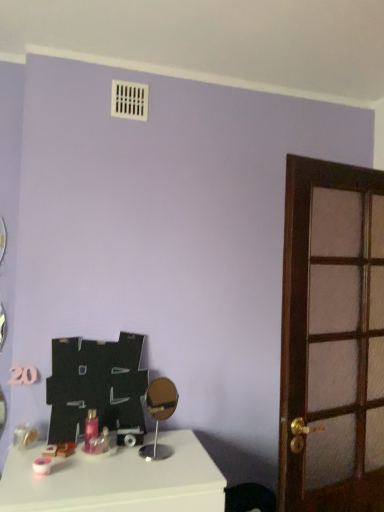
Measure the distance between point [152,391] and camera.

Point [152,391] is 2.02 meters from camera.

At what (x,y) coordinates should I click in order to perform the action: click on white glossy table at lower left. Please return your answer as a coordinate pair (x, y). The image size is (384, 512). Looking at the image, I should click on (116, 480).

Where is `pink glossy bottle at center`? The width and height of the screenshot is (384, 512). pink glossy bottle at center is located at coordinates (90, 429).

You are a GUI agent. You are given a task and a screenshot of the screen. Output one action in this format:
    pyautogui.click(x=<x>, y=<y>)
    Task: Click on the brown wooden door at right
    This screenshot has width=384, height=512.
    Given the screenshot: What is the action you would take?
    pyautogui.click(x=332, y=339)

Can you confirm if white glossy table at lower left is positioned to the right of pink glossy bottle at center?

Correct, you'll find white glossy table at lower left to the right of pink glossy bottle at center.

Considering the relative sizes of white glossy table at lower left and pink glossy bottle at center in the image provided, is white glossy table at lower left shorter than pink glossy bottle at center?

No, white glossy table at lower left is not shorter than pink glossy bottle at center.

Based on the photo, considering the relative sizes of white glossy table at lower left and pink glossy bottle at center in the image provided, is white glossy table at lower left thinner than pink glossy bottle at center?

No, white glossy table at lower left is not thinner than pink glossy bottle at center.

Is white glossy table at lower left turned away from pink glossy bottle at center?

No.

From a real-world perspective, between pink glossy bottle at center and white glossy table at lower left, who is vertically higher?

pink glossy bottle at center.

Considering the sizes of pink glossy bottle at center and white glossy table at lower left in the image, is pink glossy bottle at center bigger or smaller than white glossy table at lower left?

Clearly, pink glossy bottle at center is smaller in size than white glossy table at lower left.

Which of these two, pink glossy bottle at center or white glossy table at lower left, is thinner?

pink glossy bottle at center.

From their relative heights in the image, would you say pink glossy bottle at center is taller or shorter than white glossy table at lower left?

pink glossy bottle at center is shorter than white glossy table at lower left.

Locate an element on the screen. This screenshot has width=384, height=512. door in front of the gold metallic mirror at center is located at coordinates (332, 339).

Which point is more forward, (146,396) or (349,348)?

Positioned in front is point (349,348).

Looking at the image, does gold metallic mirror at center seem bigger or smaller compared to brown wooden door at right?

Clearly, gold metallic mirror at center is smaller in size than brown wooden door at right.

Who is shorter, gold metallic mirror at center or brown wooden door at right?

Standing shorter between the two is gold metallic mirror at center.

Considering the positions of point (367, 490) and point (163, 381), is point (367, 490) closer or farther from the camera than point (163, 381)?

Point (367, 490) is closer to the camera than point (163, 381).

Find the location of a particular element. door above the gold metallic mirror at center (from a real-world perspective) is located at coordinates click(x=332, y=339).

From the picture: Which is more to the left, brown wooden door at right or gold metallic mirror at center?

gold metallic mirror at center is more to the left.

Is brown wooden door at right positioned with its back to gold metallic mirror at center?

No, brown wooden door at right is not facing the opposite direction of gold metallic mirror at center.

Between point (203, 473) and point (160, 404), which one is positioned behind?

Point (160, 404)

From the image's perspective, is white glossy table at lower left located above or below gold metallic mirror at center?

Clearly, from the image's perspective, white glossy table at lower left is below gold metallic mirror at center.

From the picture: What's the angular difference between white glossy table at lower left and gold metallic mirror at center's facing directions?

white glossy table at lower left and gold metallic mirror at center are facing 22.5 degrees away from each other.

In the scene shown: Considering the positions of objects white glossy table at lower left and gold metallic mirror at center in the image provided, who is behind, white glossy table at lower left or gold metallic mirror at center?

Positioned behind is gold metallic mirror at center.

Is point (95, 415) less distant than point (160, 388)?

Yes.

Considering the relative positions of pink glossy bottle at center and gold metallic mirror at center in the image provided, is pink glossy bottle at center to the left of gold metallic mirror at center from the viewer's perspective?

Yes.

From a real-world perspective, is pink glossy bottle at center beneath gold metallic mirror at center?

Yes, from a real-world perspective, pink glossy bottle at center is under gold metallic mirror at center.

Can you tell me how much pink glossy bottle at center and gold metallic mirror at center differ in facing direction?

23.4 degrees separate the facing orientations of pink glossy bottle at center and gold metallic mirror at center.

Is brown wooden door at right positioned with its back to white glossy table at lower left?

No, brown wooden door at right is not facing the opposite direction of white glossy table at lower left.

Considering the positions of point (371, 361) and point (186, 434), is point (371, 361) closer or farther from the camera than point (186, 434)?

Point (371, 361) appears to be closer to the viewer than point (186, 434).

From the image's perspective, is brown wooden door at right located above or below white glossy table at lower left?

Clearly, from the image's perspective, brown wooden door at right is above white glossy table at lower left.

From a real-world perspective, is brown wooden door at right located higher than white glossy table at lower left?

Indeed, from a real-world perspective, brown wooden door at right stands above white glossy table at lower left.

This screenshot has width=384, height=512. In the image, there is a pink glossy bottle at center. In order to click on table below it (from a real-world perspective) in this screenshot , I will do coord(116,480).

Where is `toiletry lying behind the white glossy table at lower left`? The width and height of the screenshot is (384, 512). toiletry lying behind the white glossy table at lower left is located at coordinates (90, 429).

Considering their positions, is gold metallic mirror at center positioned closer to pink glossy bottle at center than brown wooden door at right?

The object closer to pink glossy bottle at center is gold metallic mirror at center.

When comparing their distances from white glossy table at lower left, does brown wooden door at right or pink glossy bottle at center seem closer?

The object closer to white glossy table at lower left is pink glossy bottle at center.

When comparing their distances from gold metallic mirror at center, does pink glossy bottle at center or white glossy table at lower left seem closer?

Based on the image, white glossy table at lower left appears to be nearer to gold metallic mirror at center.

Looking at the image, which one is located further to brown wooden door at right, pink glossy bottle at center or white glossy table at lower left?

Among the two, pink glossy bottle at center is located further to brown wooden door at right.

From the image, which object appears to be nearer to gold metallic mirror at center, white glossy table at lower left or brown wooden door at right?

Among the two, white glossy table at lower left is located nearer to gold metallic mirror at center.

Considering their positions, is pink glossy bottle at center positioned further to white glossy table at lower left than gold metallic mirror at center?

Based on the image, pink glossy bottle at center appears to be further to white glossy table at lower left.

Considering their positions, is gold metallic mirror at center positioned further to pink glossy bottle at center than white glossy table at lower left?

gold metallic mirror at center is positioned further to the anchor pink glossy bottle at center.

Which object lies further to the anchor point brown wooden door at right, white glossy table at lower left or pink glossy bottle at center?

pink glossy bottle at center lies further to brown wooden door at right than the other object.

Where is `table located between pink glossy bottle at center and brown wooden door at right in the left-right direction`? This screenshot has height=512, width=384. table located between pink glossy bottle at center and brown wooden door at right in the left-right direction is located at coordinates (116, 480).

At what (x,y) coordinates should I click in order to perform the action: click on mirror positioned between white glossy table at lower left and pink glossy bottle at center from near to far. Please return your answer as a coordinate pair (x, y). Image resolution: width=384 pixels, height=512 pixels. Looking at the image, I should click on (159, 415).

The width and height of the screenshot is (384, 512). Identify the location of mirror between white glossy table at lower left and brown wooden door at right in the horizontal direction. (159, 415).

The image size is (384, 512). I want to click on mirror located between pink glossy bottle at center and brown wooden door at right in the left-right direction, so click(159, 415).